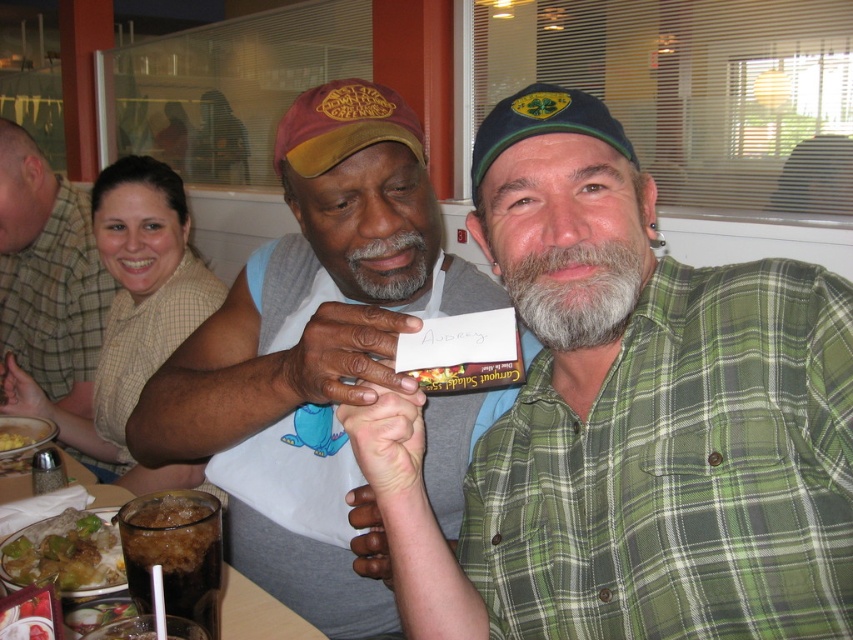
From the picture: Between gray cotton t-shirt at center and green plaid shirt at upper right, which one appears on the left side from the viewer's perspective?

Positioned to the left is green plaid shirt at upper right.

Consider the image. Is gray cotton t-shirt at center positioned before green plaid shirt at upper right?

Yes, gray cotton t-shirt at center is closer to the viewer.

Does point (363, 230) come farther from viewer compared to point (71, 269)?

That is False.

Locate an element on the screen. This screenshot has width=853, height=640. gray cotton t-shirt at center is located at coordinates (306, 355).

Is green plaid shirt at upper right shorter than graysoftbeard at right?

No.

Does green plaid shirt at upper right have a smaller size compared to graysoftbeard at right?

Incorrect, green plaid shirt at upper right is not smaller in size than graysoftbeard at right.

Image resolution: width=853 pixels, height=640 pixels. Identify the location of green plaid shirt at upper right. (48, 275).

Is graysoftbeard at right thinner than brown glossy rice bowl at lower left?

Yes, graysoftbeard at right is thinner than brown glossy rice bowl at lower left.

Locate an element on the screen. The image size is (853, 640). graysoftbeard at right is located at coordinates (578, 291).

You are a GUI agent. You are given a task and a screenshot of the screen. Output one action in this format:
    pyautogui.click(x=<x>, y=<y>)
    Task: Click on the graysoftbeard at right
    
    Given the screenshot: What is the action you would take?
    pyautogui.click(x=578, y=291)